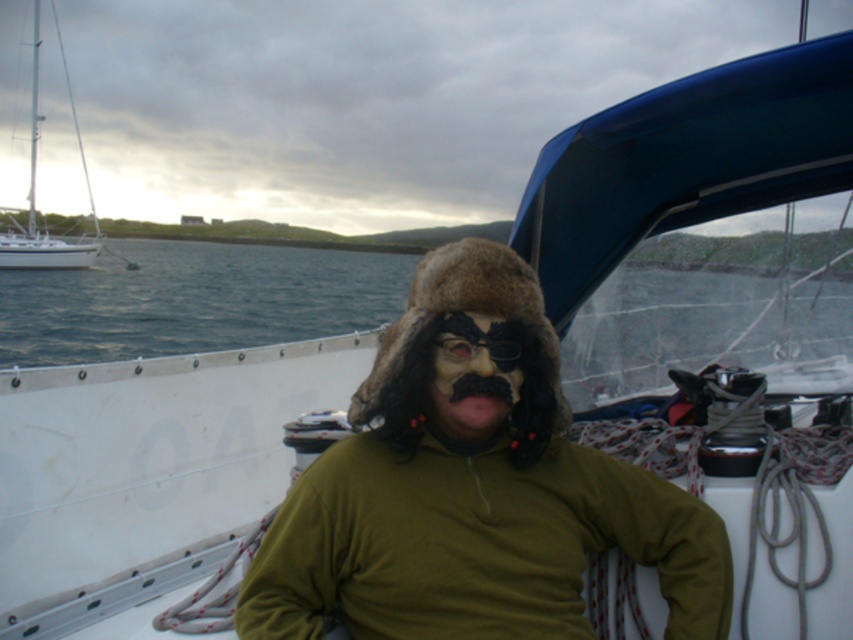
Question: Is fuzzy brown fur hat at center wider than white glossy sailboat at left?

Choices:
 (A) yes
 (B) no

Answer: (B)

Question: Can you confirm if blue water at left is thinner than black matte goggles at center?

Choices:
 (A) no
 (B) yes

Answer: (A)

Question: Can you confirm if brown fur hat at center is thinner than black matte goggles at center?

Choices:
 (A) no
 (B) yes

Answer: (A)

Question: Among these objects, which one is nearest to the camera?

Choices:
 (A) fuzzy brown hat at center
 (B) brown fur nose at center
 (C) white glossy sailboat at left
 (D) fuzzy brown fur hat at center

Answer: (B)

Question: Which of the following is the closest to the observer?

Choices:
 (A) fuzzy brown fur hat at center
 (B) brown fur nose at center
 (C) black fuzzy beard at center

Answer: (B)

Question: Among these objects, which one is farthest from the camera?

Choices:
 (A) white glossy sailboat at left
 (B) brown fur nose at center

Answer: (A)